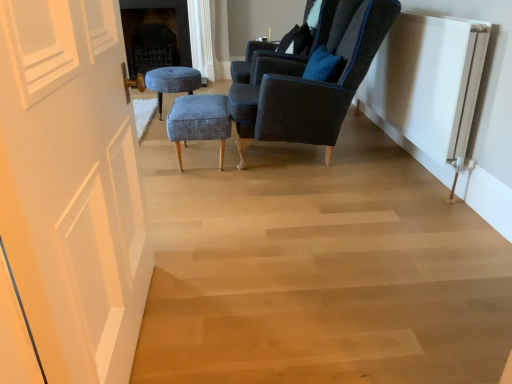
At what (x,y) coordinates should I click in order to perform the action: click on vacant space behind white painted wood door at left. Please return your answer as a coordinate pair (x, y). The image size is (512, 384). Looking at the image, I should click on (205, 261).